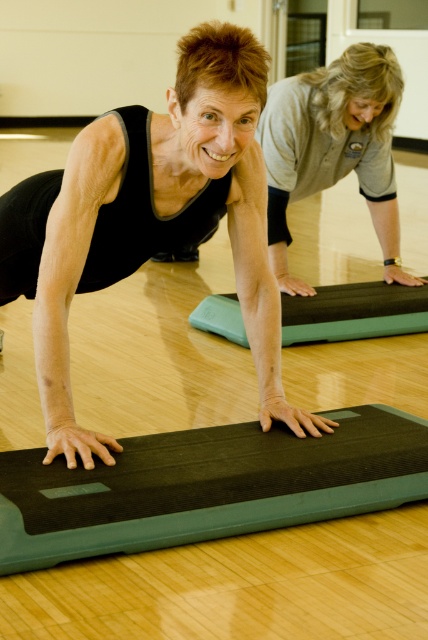
This screenshot has width=428, height=640. What do you see at coordinates (151, 220) in the screenshot?
I see `black rubber mat at center` at bounding box center [151, 220].

The width and height of the screenshot is (428, 640). What are the coordinates of `black rubber mat at center` in the screenshot? It's located at [x=151, y=220].

Is point (190, 35) closer to camera compared to point (382, 413)?

Yes, it is in front of point (382, 413).

The height and width of the screenshot is (640, 428). Identify the location of black rubber mat at center. (151, 220).

Who is positioned more to the left, black rubber yoga mat at center or green rubber yoga mat at center?

From the viewer's perspective, black rubber yoga mat at center appears more on the left side.

Does black rubber yoga mat at center have a lesser width compared to green rubber yoga mat at center?

No.

Does point (127, 483) come in front of point (336, 307)?

That is True.

You are a GUI agent. You are given a task and a screenshot of the screen. Output one action in this format:
    pyautogui.click(x=<x>, y=<y>)
    Task: Click on the black rubber yoga mat at center
    The width and height of the screenshot is (428, 640).
    Given the screenshot: What is the action you would take?
    pyautogui.click(x=207, y=486)

Based on the photo, who is positioned more to the right, black rubber mat at center or green rubber yoga mat at center?

Positioned to the right is green rubber yoga mat at center.

Can you confirm if black rubber mat at center is bigger than green rubber yoga mat at center?

Yes, black rubber mat at center is bigger than green rubber yoga mat at center.

What do you see at coordinates (151, 220) in the screenshot? I see `black rubber mat at center` at bounding box center [151, 220].

Identify the location of black rubber mat at center. (151, 220).